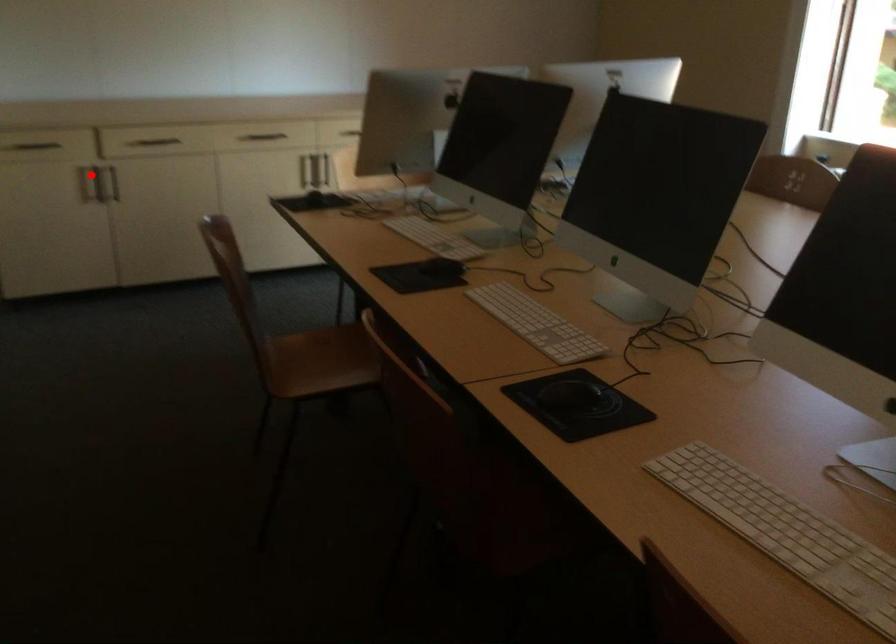
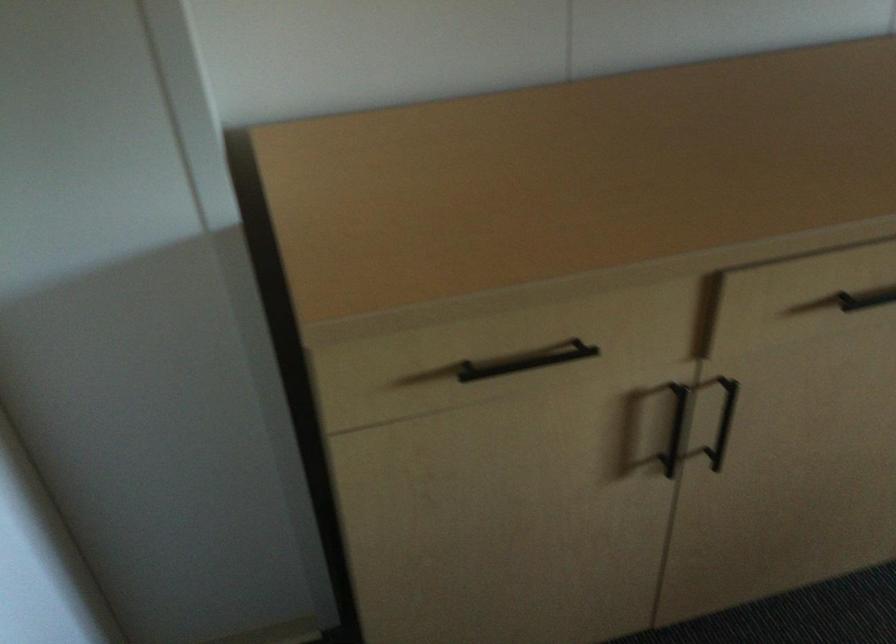
Question: I am providing you with two images of the same scene from different viewpoints. Given a red point in image1, look at the same physical point in image2. Is it:

Choices:
 (A) Closer to the viewpoint
 (B) Farther from the viewpoint

Answer: (A)